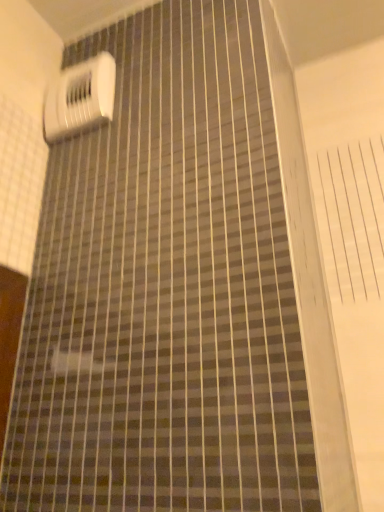
Measure the distance between white plastic air conditioning unit at upper left and camera.

They are 35.62 inches apart.

The image size is (384, 512). What do you see at coordinates (79, 98) in the screenshot? I see `white plastic air conditioning unit at upper left` at bounding box center [79, 98].

Identify the location of white plastic air conditioning unit at upper left. The width and height of the screenshot is (384, 512). (79, 98).

I want to click on white plastic air conditioning unit at upper left, so pyautogui.click(x=79, y=98).